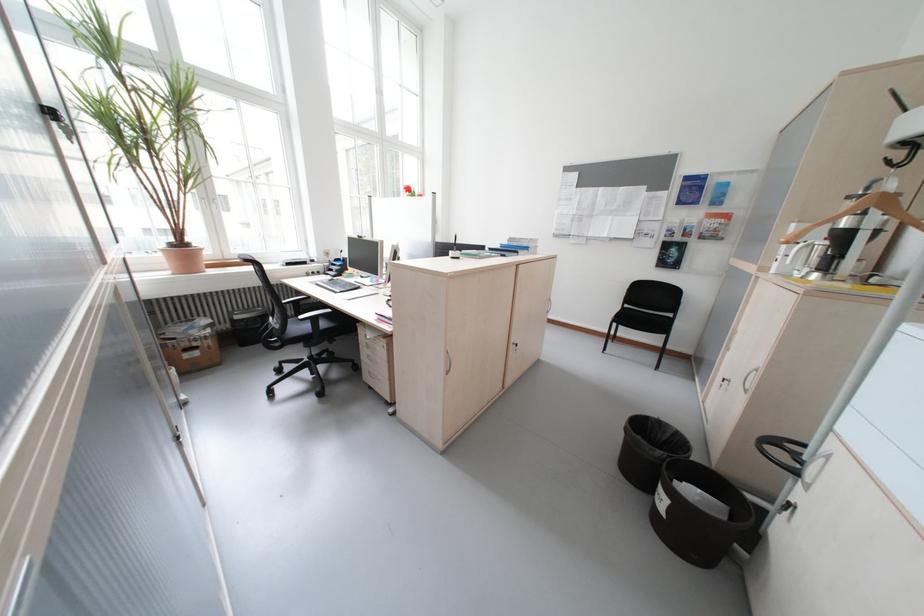
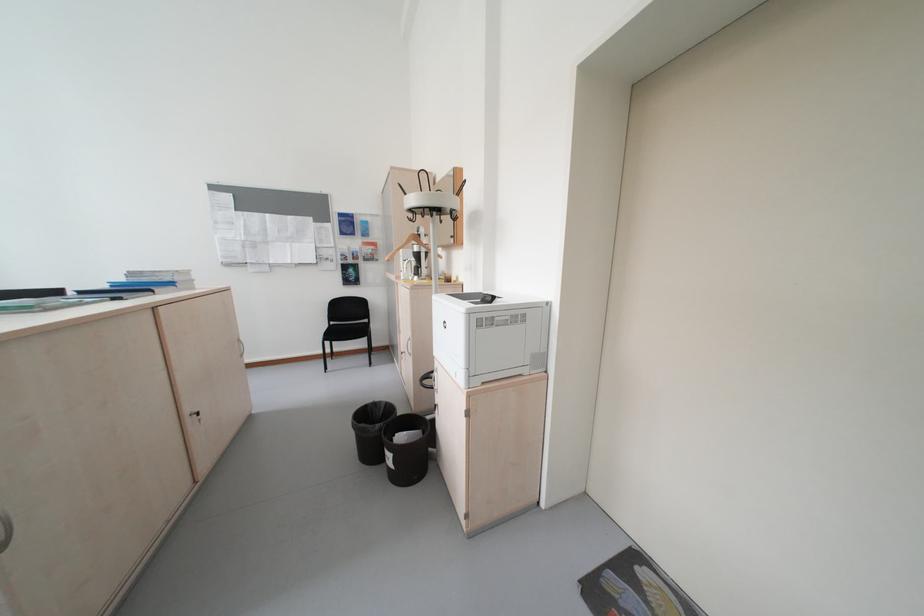
Locate, in the second image, the point that corresponds to [670,454] in the first image.

(388, 427)